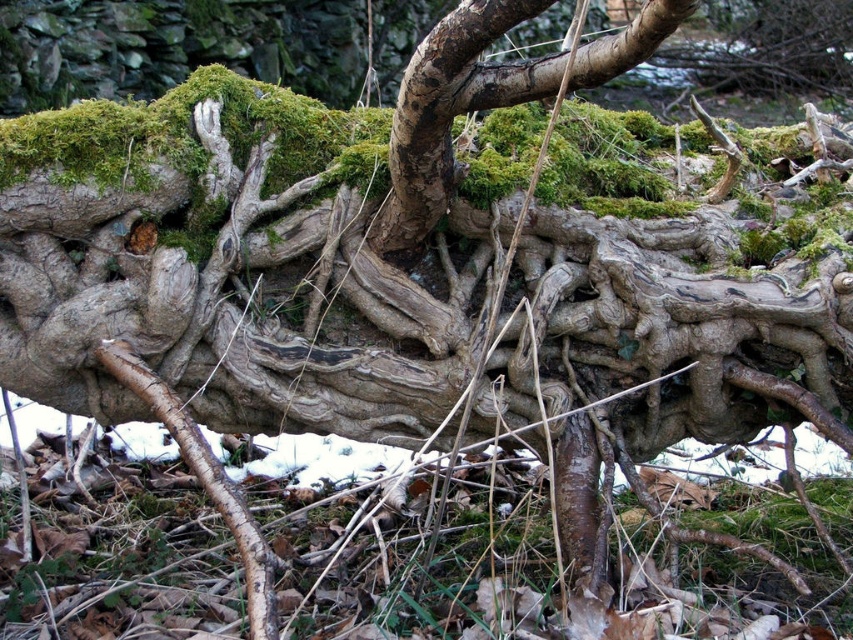
You are a botanist examining the tree roots in the scene. You need to locate the green mossy bark at center. Where exactly would you find it?

The green mossy bark at center is located at point coordinates of (434, 120).

You are a small animal trying to navigate through the forest floor. You need to move from the green mossy bark at center to the barky brown root at lower left. Is the path between them wide enough for you if you are 10 inches long?

The distance between the green mossy bark at center and the barky brown root at lower left is 16.41 inches, which is wider than your 10 inch length. Therefore, the path is wide enough for you to navigate through.

Based on the photo, you are a botanist examining the tree roots in the forest. You notice the green mossy bark at center and the barky brown root at lower left. Which of these two has a smaller width?

The green mossy bark at center has a smaller width than the barky brown root at lower left according to the description.